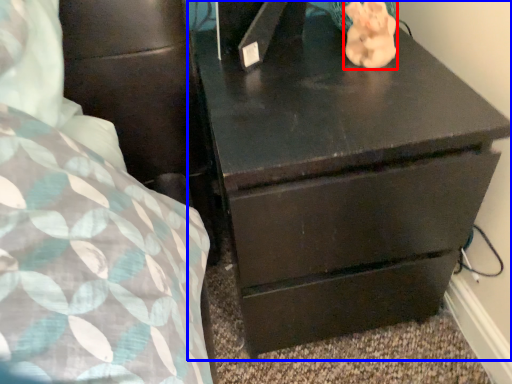
Question: Which of the following is the closest to the observer, animal (highlighted by a red box) or chest of drawers (highlighted by a blue box)?

Choices:
 (A) animal
 (B) chest of drawers

Answer: (B)